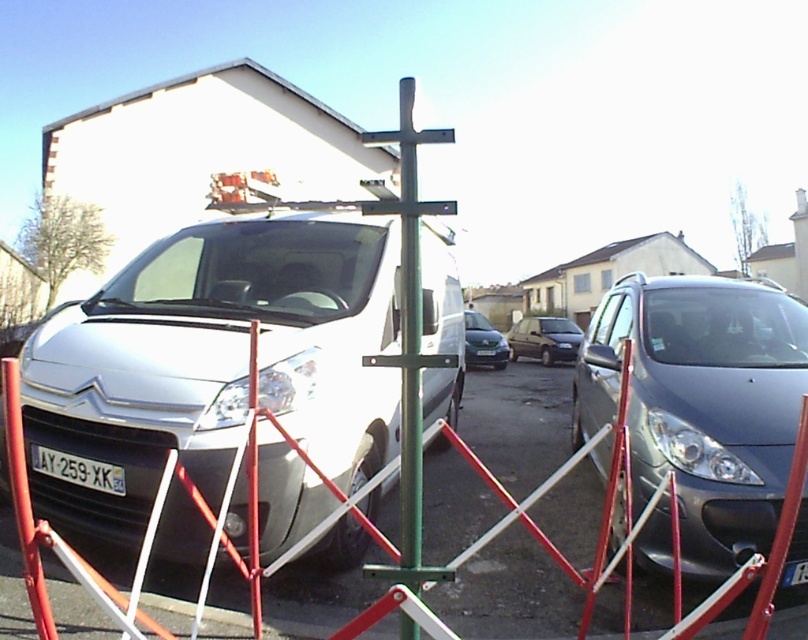
Question: Considering the relative positions of silver metallic van at left and dark gray metallic hatchback at center in the image provided, where is silver metallic van at left located with respect to dark gray metallic hatchback at center?

Choices:
 (A) above
 (B) below

Answer: (A)

Question: Among these objects, which one is nearest to the camera?

Choices:
 (A) silver metallic hatchback at center
 (B) silver metallic van at left
 (C) black plastic license plate at lower left

Answer: (B)

Question: Which of these objects is positioned closest to the silver metallic van at left?

Choices:
 (A) black plastic license plate at lower left
 (B) yellow matte license plate at center
 (C) metallic gray minivan at right
 (D) dark gray metallic hatchback at center

Answer: (A)

Question: Is silver metallic van at left bigger than black plastic license plate at lower left?

Choices:
 (A) no
 (B) yes

Answer: (B)

Question: Is green metallic cross at center further to camera compared to yellow matte license plate at center?

Choices:
 (A) no
 (B) yes

Answer: (A)

Question: Among these objects, which one is nearest to the camera?

Choices:
 (A) silver metallic van at left
 (B) green metallic cross at center
 (C) silver metallic hatchback at center

Answer: (B)